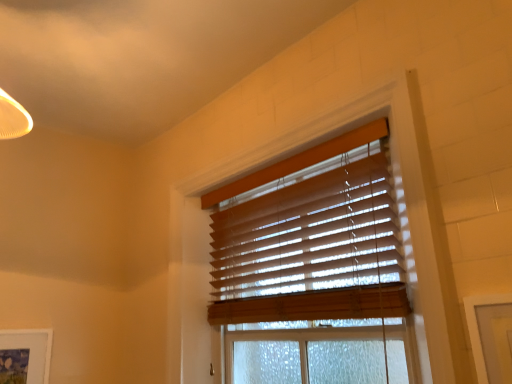
Locate an element on the screen. The height and width of the screenshot is (384, 512). wooden blinds at upper center is located at coordinates (310, 239).

Measure the distance between point [369,164] and camera.

They are 1.42 meters apart.

What do you see at coordinates (310, 239) in the screenshot? I see `wooden blinds at upper center` at bounding box center [310, 239].

In order to face wooden blinds at upper center, should I rotate leftwards or rightwards?

It's best to rotate right around 3.408 degrees.

Locate an element on the screen. This screenshot has height=384, width=512. wooden blinds at upper center is located at coordinates (310, 239).